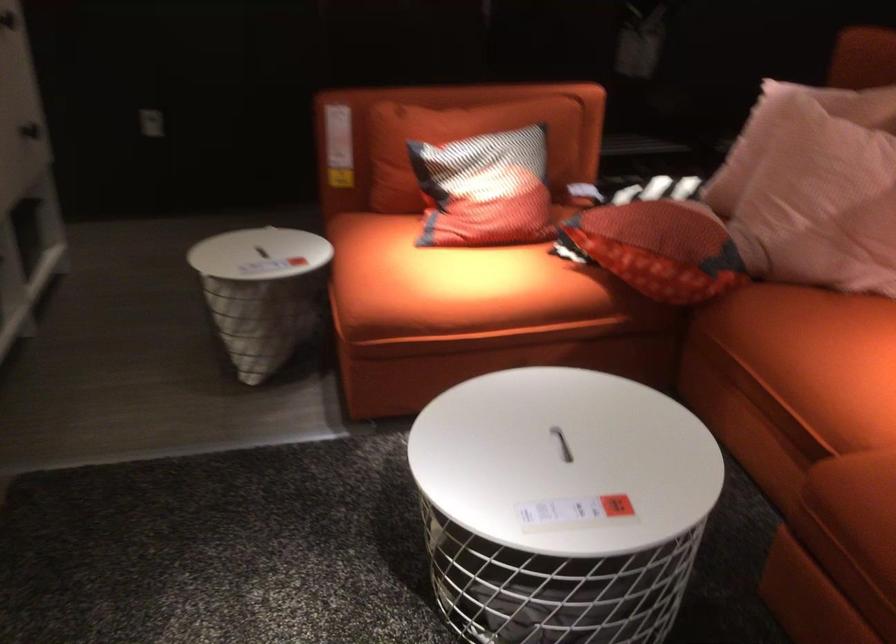
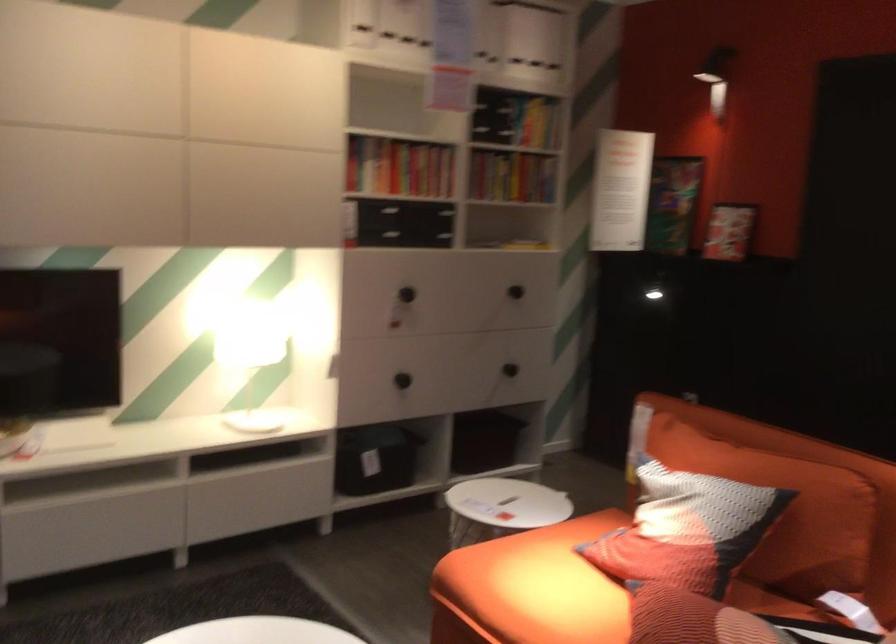
The point at (x=455, y=281) is marked in the first image. Where is the corresponding point in the second image?

(531, 588)